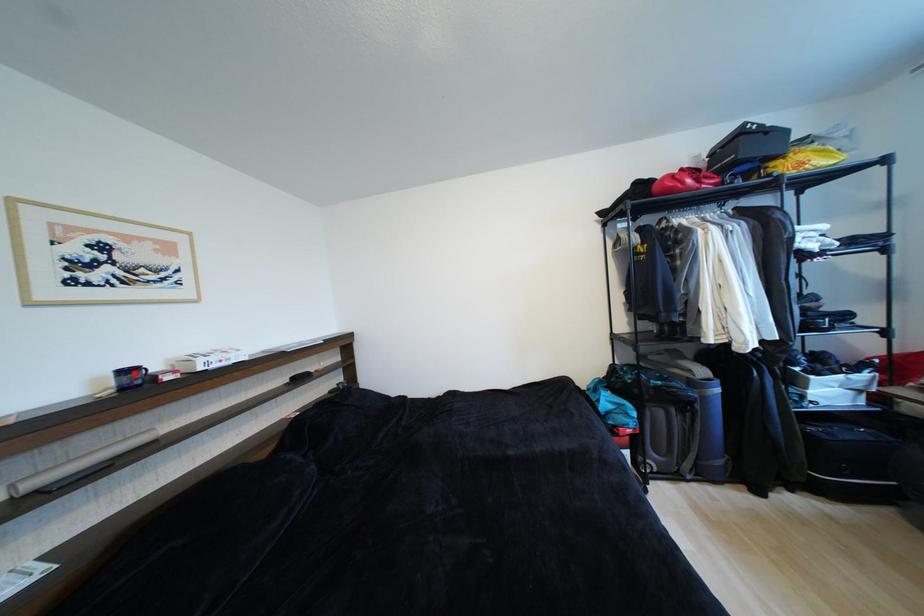
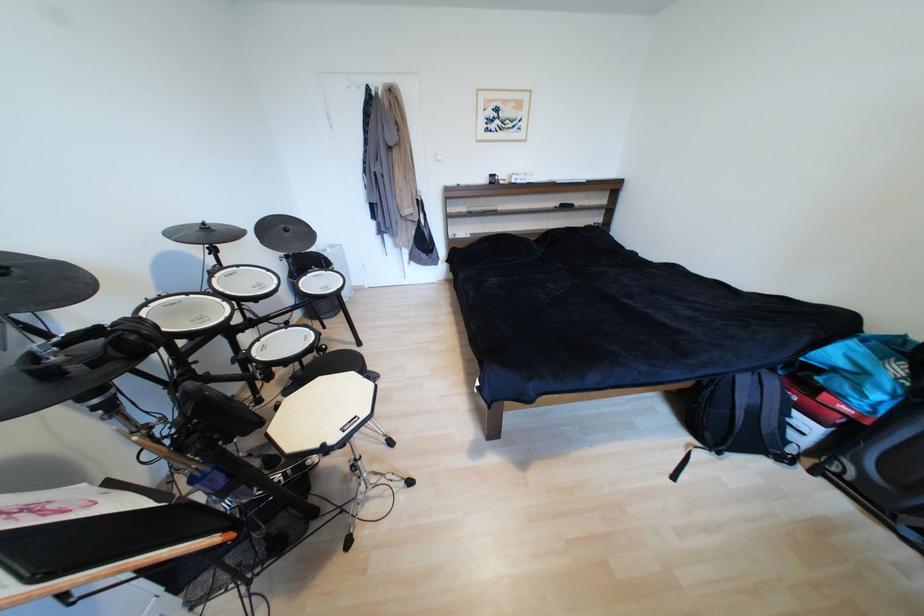
Question: A red point is marked in image1. In image2, is the corresponding 3D point closer to the camera or farther? Reply with the corresponding letter.

Choices:
 (A) The corresponding 3D point is closer.
 (B) The corresponding 3D point is farther.

Answer: (A)